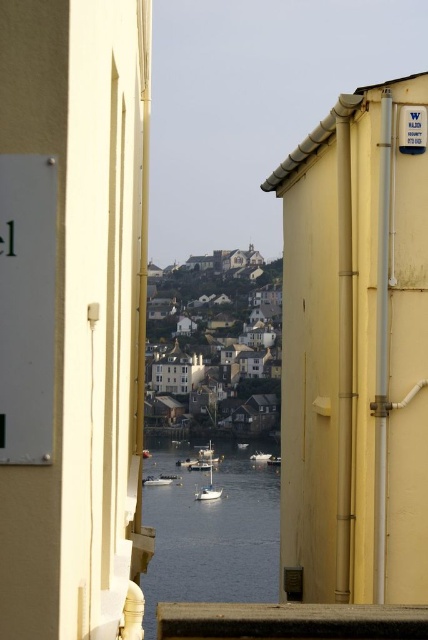
Question: Does white glossy boat at center have a greater width compared to white matte boat at center?

Choices:
 (A) yes
 (B) no

Answer: (A)

Question: Which object is the farthest from the white glossy sailboat at center?

Choices:
 (A) smooth water at center
 (B) white matte boat at center
 (C) white glossy boat at center

Answer: (B)

Question: Which point appears farthest from the camera in this image?

Choices:
 (A) (154, 476)
 (B) (214, 493)
 (C) (267, 458)
 (D) (267, 532)

Answer: (C)

Question: Is white glossy sailboat at center above white matte boat at center?

Choices:
 (A) yes
 (B) no

Answer: (B)

Question: Can you confirm if white glossy boat at center is smaller than white matte boat at center?

Choices:
 (A) no
 (B) yes

Answer: (A)

Question: Which point is farther to the camera?

Choices:
 (A) smooth water at center
 (B) white glossy boat at center
 (C) white matte boat at center
 (D) white glossy sailboat at center

Answer: (C)